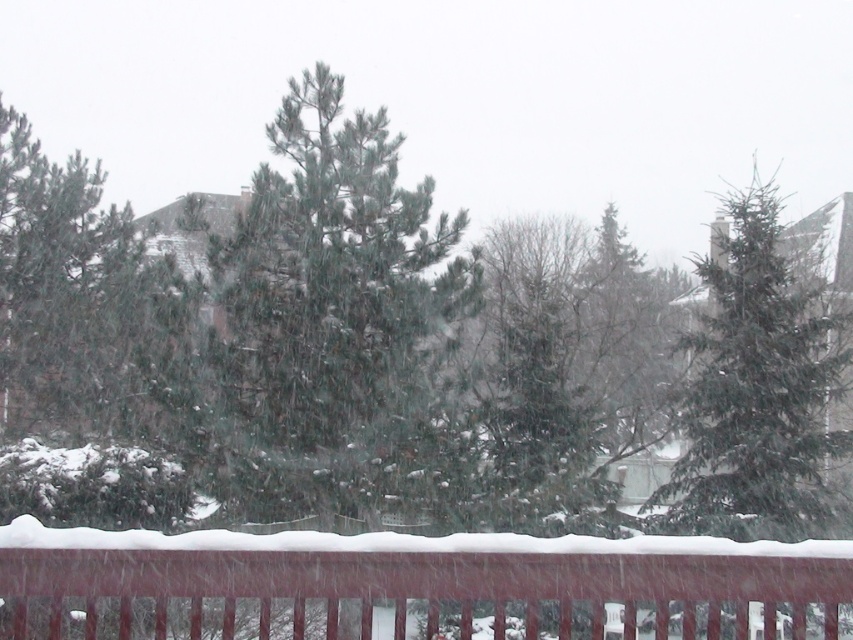
Question: Is smooth wooden fence at bottom to the left of green needle-like at upper right from the viewer's perspective?

Choices:
 (A) no
 (B) yes

Answer: (B)

Question: Observing the image, what is the correct spatial positioning of green needle-like at center in reference to green needle-like at upper right?

Choices:
 (A) below
 (B) above

Answer: (A)

Question: Does smooth wooden fence at bottom appear under green needle-like at upper right?

Choices:
 (A) no
 (B) yes

Answer: (B)

Question: Among these objects, which one is nearest to the camera?

Choices:
 (A) smooth wooden fence at bottom
 (B) green needle-like at upper right
 (C) green needle-like at center

Answer: (A)

Question: Which of these objects is positioned closest to the green needle-like at center?

Choices:
 (A) green needle-like at upper right
 (B) smooth wooden fence at bottom

Answer: (A)

Question: Which object appears closest to the camera in this image?

Choices:
 (A) smooth wooden fence at bottom
 (B) green needle-like at upper right
 (C) green needle-like at center

Answer: (A)